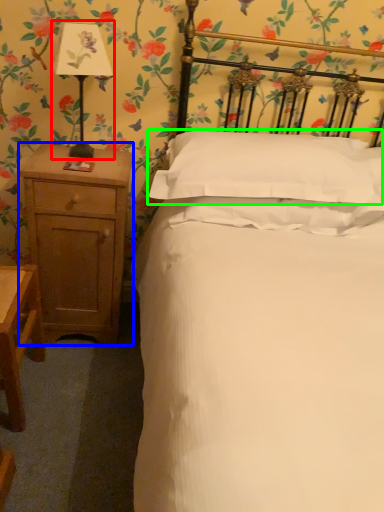
Question: Which object is positioned farthest from bedside lamp (highlighted by a red box)? Select from nightstand (highlighted by a blue box) and pillow (highlighted by a green box).

Choices:
 (A) nightstand
 (B) pillow

Answer: (B)